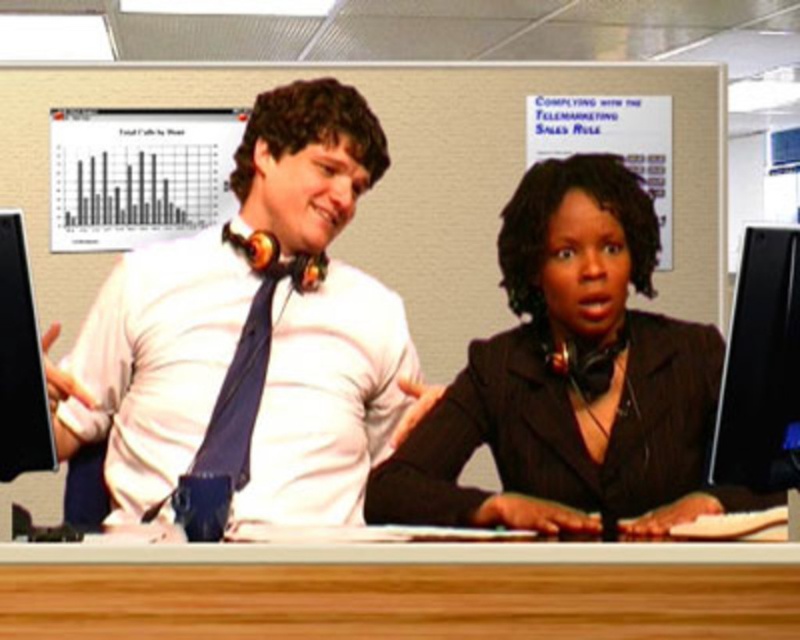
You are standing in front of the desk and want to place a small object on the desk. You have two points marked on the desk where you can place it. The points are labeled as point (284,148) and point (748,465). Which point is closer to you so that you can easily reach it without moving your chair?

Point (284,148) is closer to you than point (748,465), so you can easily reach it without moving your chair.

You are an office worker who needs to hang a name tag on the matte white shirt at upper left and the black glossy monitor at right. Since the monitor is lower, where should you place the name tag on the shirt to ensure both tags are at the same height?

Since the matte white shirt at upper left is taller than the black glossy monitor at right, you should place the name tag lower on the matte white shirt at upper left so that both tags align at the same height.